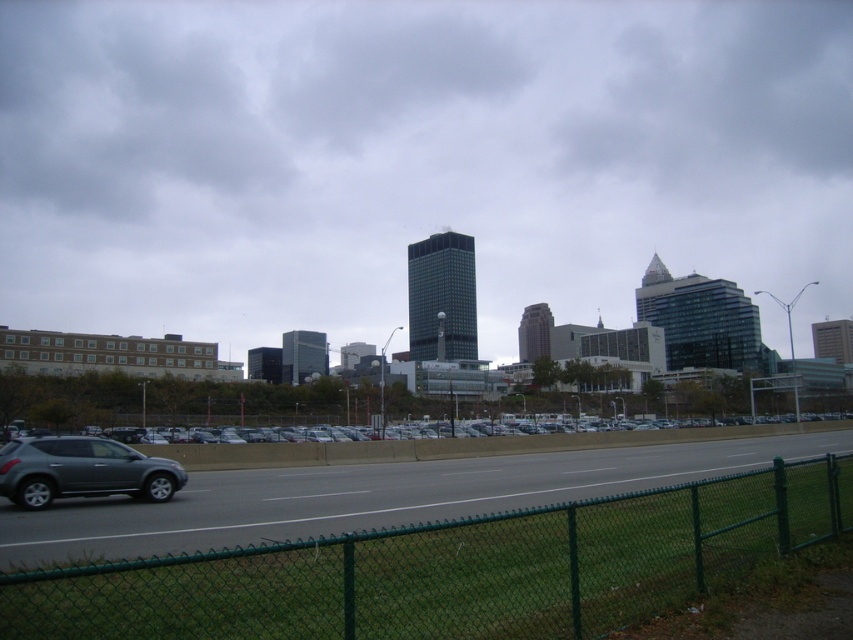
Question: Which of the following is the closest to the observer?

Choices:
 (A) green chain-link fence at lower center
 (B) transparent glass skyscraper at center
 (C) silver metallic sedan at center
 (D) satin gray suv at lower left

Answer: (A)

Question: Does transparent glass skyscraper at center have a greater width compared to green chain-link fence at lower center?

Choices:
 (A) yes
 (B) no

Answer: (A)

Question: Is transparent glass skyscraper at center in front of green chain-link fence at lower center?

Choices:
 (A) no
 (B) yes

Answer: (A)

Question: Based on their relative distances, which object is nearer to the transparent glass skyscraper at center?

Choices:
 (A) satin gray suv at lower left
 (B) green chain-link fence at lower center

Answer: (B)

Question: Is green chain-link fence at lower center wider than silver metallic sedan at center?

Choices:
 (A) yes
 (B) no

Answer: (B)

Question: Which point is farther to the camera?

Choices:
 (A) satin gray suv at lower left
 (B) green chain-link fence at lower center
 (C) silver metallic sedan at center
 (D) transparent glass skyscraper at center

Answer: (D)